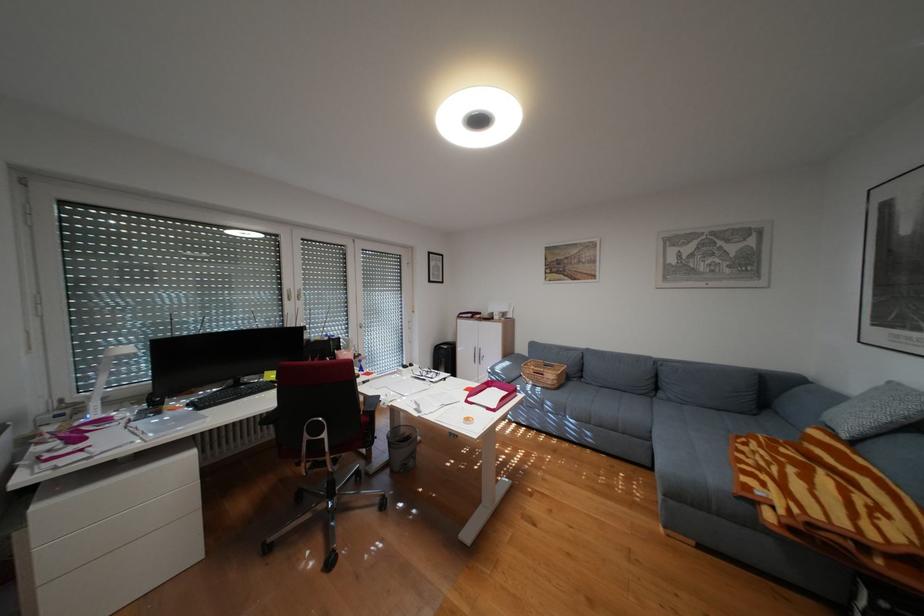
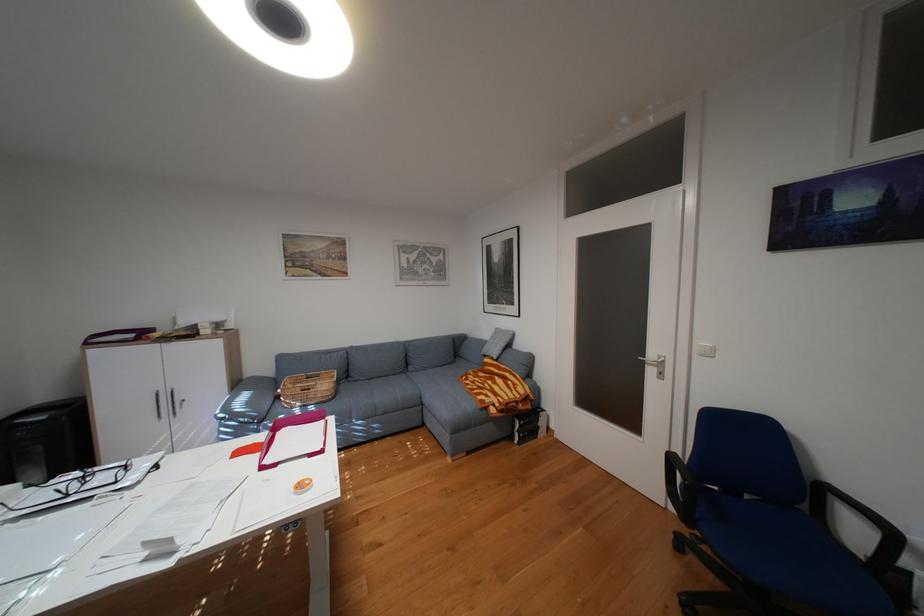
Question: How did the camera likely rotate?

Choices:
 (A) Left
 (B) Right
 (C) Up
 (D) Down

Answer: (B)